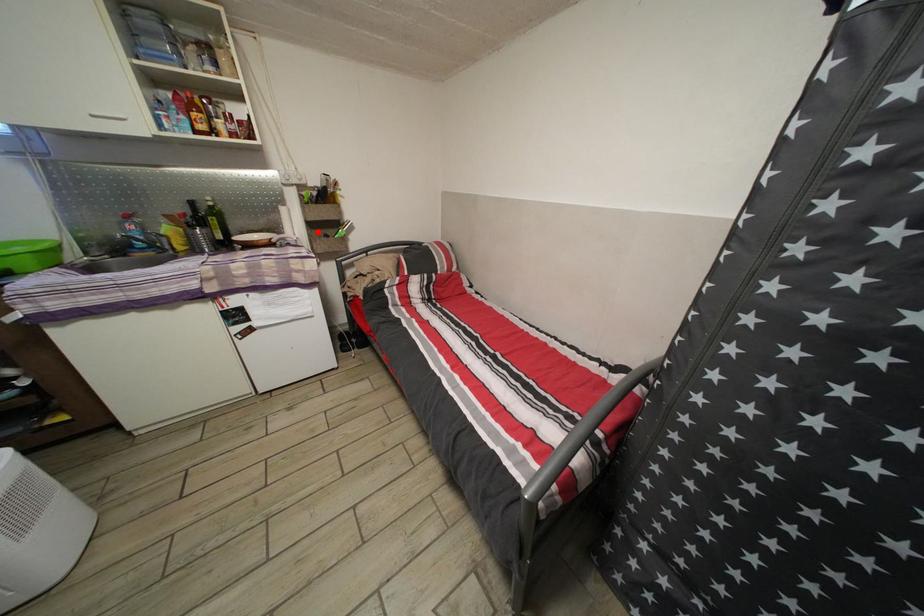
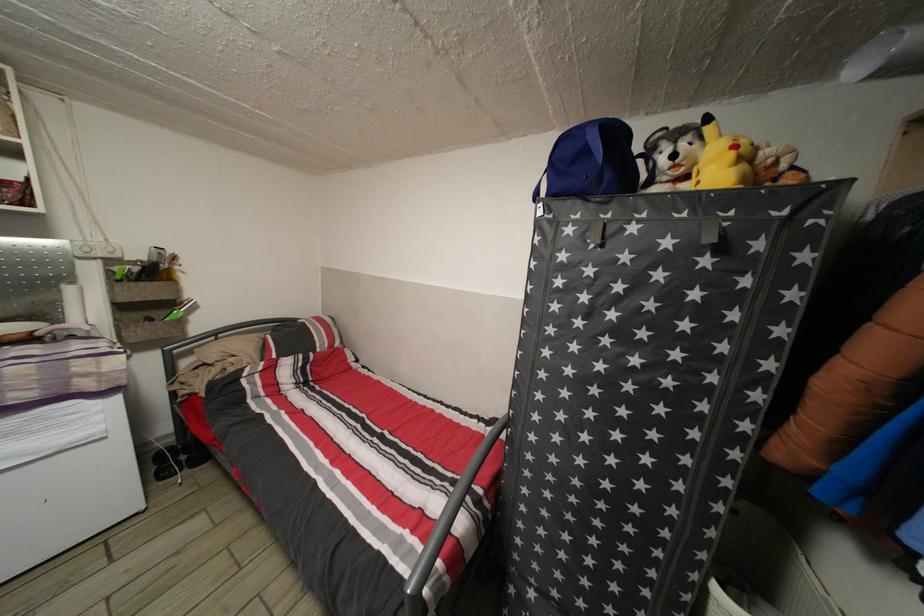
The point at the highlighted location is marked in the first image. Where is the corresponding point in the second image?

(128, 314)